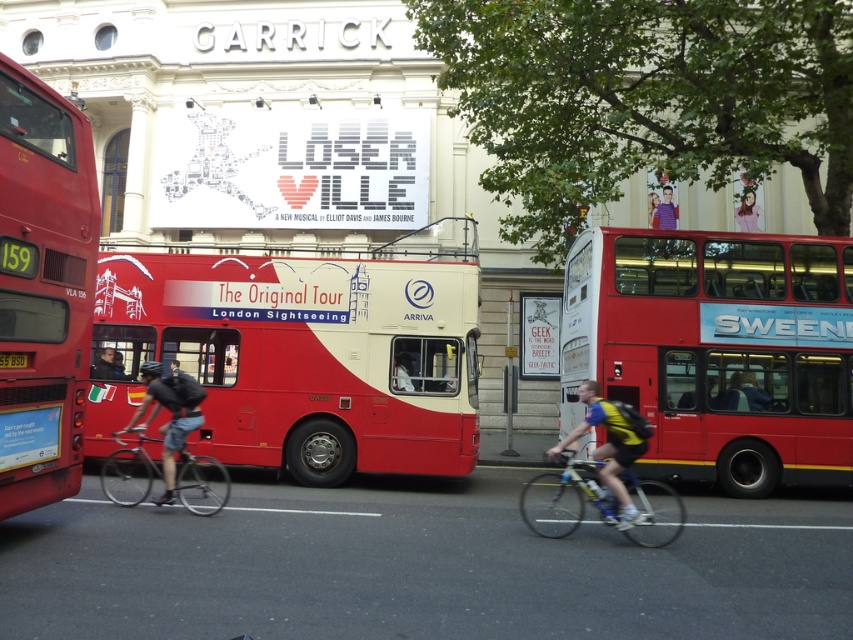
You are a delivery person trying to navigate through the busy street scene. You see two points marked on the image. The first point is at coordinates point (28, 451) and the second point is at point (592, 452). Which point is closer to you as you stand at the starting position?

Point (28, 451) is in front of point (592, 452), so the first point is closer to you.

Looking at this image, you are a pedestrian standing on the sidewalk and see both the silver metallic bicycle at center and the yellow and blue cycling jersey at center. Which object is closer to the left edge of the image?

The silver metallic bicycle at center is positioned on the left side of the yellow and blue cycling jersey at center, so it is closer to the left edge of the image.